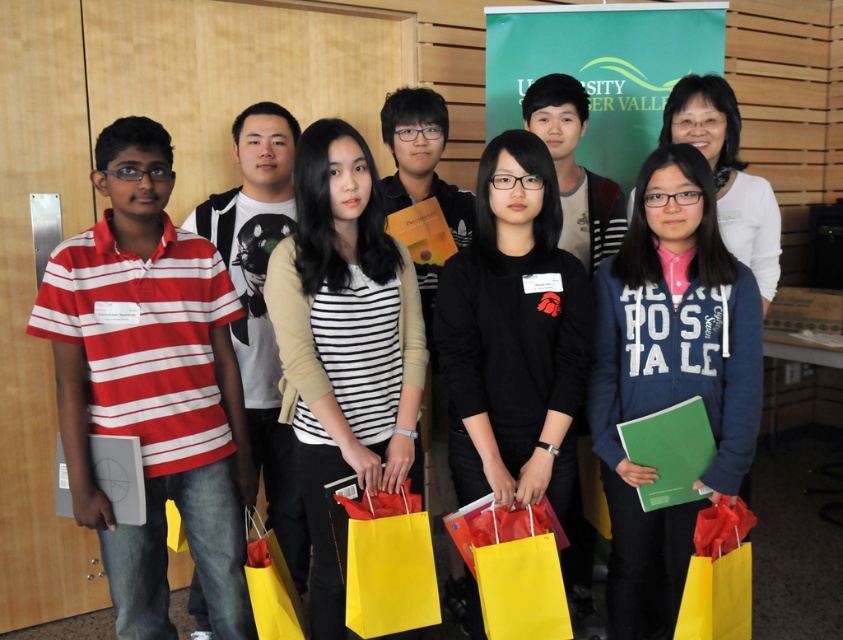
Question: Which point is closer to the camera?

Choices:
 (A) red striped polo shirt at left
 (B) matte red shopping bag at lower right
 (C) striped jersey at center
 (D) blue fleece jacket at center

Answer: (A)

Question: Can you confirm if blue fleece jacket at center is positioned to the right of yellow paper shopping bag at lower left?

Choices:
 (A) no
 (B) yes

Answer: (B)

Question: Observing the image, what is the correct spatial positioning of red striped polo shirt at left in reference to yellow paper shopping bag at lower left?

Choices:
 (A) right
 (B) left

Answer: (B)

Question: Considering the real-world distances, which object is farthest from the striped jersey at center?

Choices:
 (A) yellow paper shopping bag at lower left
 (B) black matte shirt at center

Answer: (A)

Question: Is black matte shirt at center to the left of matte red shopping bag at lower right from the viewer's perspective?

Choices:
 (A) yes
 (B) no

Answer: (A)

Question: Estimate the real-world distances between objects in this image. Which object is farther from the red striped polo shirt at left?

Choices:
 (A) striped jersey at center
 (B) black matte shirt at center
 (C) matte red shopping bag at lower right
 (D) yellow paper shopping bag at lower left

Answer: (C)